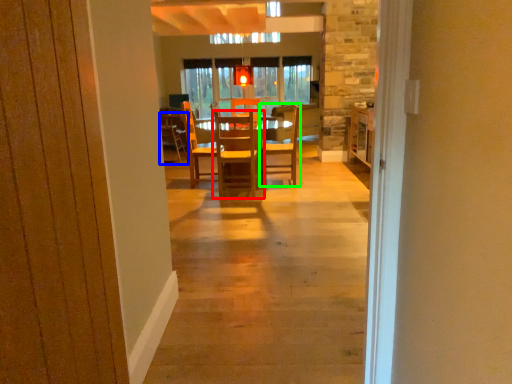
Question: Which object is the closest to the chair (highlighted by a red box)? Choose among these: chair (highlighted by a blue box) or chair (highlighted by a green box).

Choices:
 (A) chair
 (B) chair

Answer: (B)